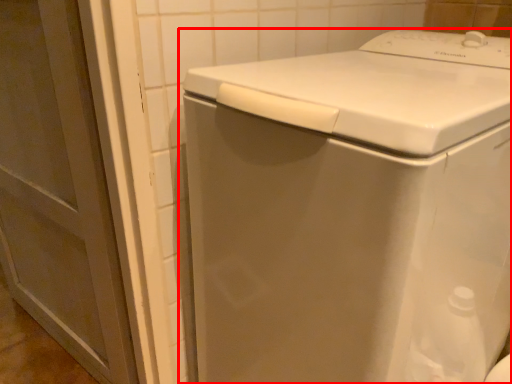
Question: In this image, where is washing machine (annotated by the red box) located relative to screen door?

Choices:
 (A) right
 (B) left

Answer: (A)